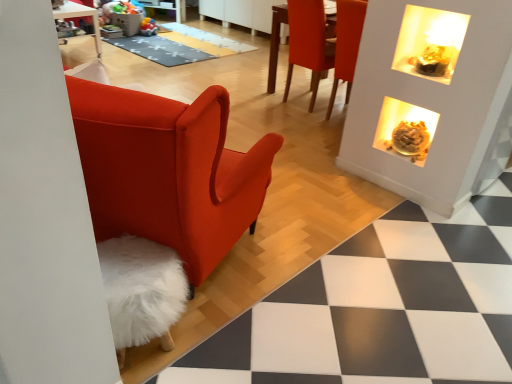
Question: Considering the relative sizes of matte orange chair at upper right and gray textured mat at center in the image provided, is matte orange chair at upper right wider than gray textured mat at center?

Choices:
 (A) yes
 (B) no

Answer: (B)

Question: Can you see matte orange chair at upper right touching gray textured mat at center?

Choices:
 (A) yes
 (B) no

Answer: (B)

Question: Is matte orange chair at upper right not near gray textured mat at center?

Choices:
 (A) yes
 (B) no

Answer: (A)

Question: Considering the relative sizes of matte orange chair at upper right and gray textured mat at center in the image provided, is matte orange chair at upper right bigger than gray textured mat at center?

Choices:
 (A) no
 (B) yes

Answer: (B)

Question: From a real-world perspective, is matte orange chair at upper right positioned over gray textured mat at center based on gravity?

Choices:
 (A) no
 (B) yes

Answer: (B)

Question: From the image's perspective, is gray textured mat at center located above or below matte orange chair at upper right?

Choices:
 (A) below
 (B) above

Answer: (B)

Question: Is point (226, 51) closer or farther from the camera than point (303, 56)?

Choices:
 (A) farther
 (B) closer

Answer: (A)

Question: Is gray textured mat at center in front of or behind matte orange chair at upper right in the image?

Choices:
 (A) behind
 (B) front

Answer: (A)

Question: Considering the positions of gray textured mat at center and matte orange chair at upper right in the image, is gray textured mat at center taller or shorter than matte orange chair at upper right?

Choices:
 (A) short
 (B) tall

Answer: (A)

Question: Is point (399, 122) closer or farther from the camera than point (181, 36)?

Choices:
 (A) closer
 (B) farther

Answer: (A)

Question: From the image's perspective, is translucent glass bowl at upper right positioned above or below gray textured mat at center?

Choices:
 (A) above
 (B) below

Answer: (B)

Question: Considering the relative positions of translucent glass bowl at upper right and gray textured mat at center in the image provided, is translucent glass bowl at upper right to the left or to the right of gray textured mat at center?

Choices:
 (A) right
 (B) left

Answer: (A)

Question: From a real-world perspective, relative to gray textured mat at center, is translucent glass bowl at upper right vertically above or below?

Choices:
 (A) below
 (B) above

Answer: (B)

Question: Considering the relative positions of matte orange chair at upper right and gray textured mat at center in the image provided, is matte orange chair at upper right to the left or to the right of gray textured mat at center?

Choices:
 (A) right
 (B) left

Answer: (A)

Question: In terms of size, does matte orange chair at upper right appear bigger or smaller than gray textured mat at center?

Choices:
 (A) big
 (B) small

Answer: (A)